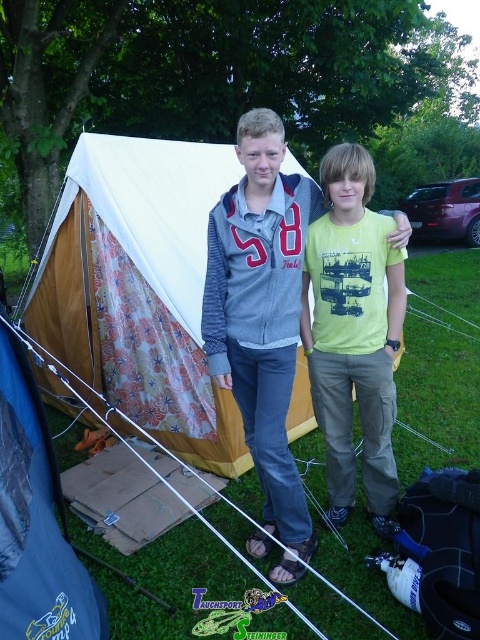
Does floral fabric tent at center appear on the right side of gray fleece jacket at center?

No, floral fabric tent at center is not to the right of gray fleece jacket at center.

Which is more to the left, floral fabric tent at center or gray fleece jacket at center?

Positioned to the left is floral fabric tent at center.

Is point (175, 413) more distant than point (239, 156)?

That is True.

This screenshot has width=480, height=640. Identify the location of floral fabric tent at center. (140, 288).

Can you confirm if floral fabric tent at center is bigger than blue tarpaulin tent at center?

Yes, floral fabric tent at center is bigger than blue tarpaulin tent at center.

Where is `floral fabric tent at center`? Image resolution: width=480 pixels, height=640 pixels. floral fabric tent at center is located at coordinates (140, 288).

This screenshot has height=640, width=480. Find the location of `floral fabric tent at center`. floral fabric tent at center is located at coordinates (140, 288).

Is gray fleece jacket at center closer to the viewer compared to blue tarpaulin tent at center?

No, it is behind blue tarpaulin tent at center.

Is gray fleece jacket at center wider than blue tarpaulin tent at center?

Yes.

Does point (268, 541) come farther from viewer compared to point (31, 609)?

Yes, point (268, 541) is behind point (31, 609).

This screenshot has width=480, height=640. Identify the location of gray fleece jacket at center. (262, 310).